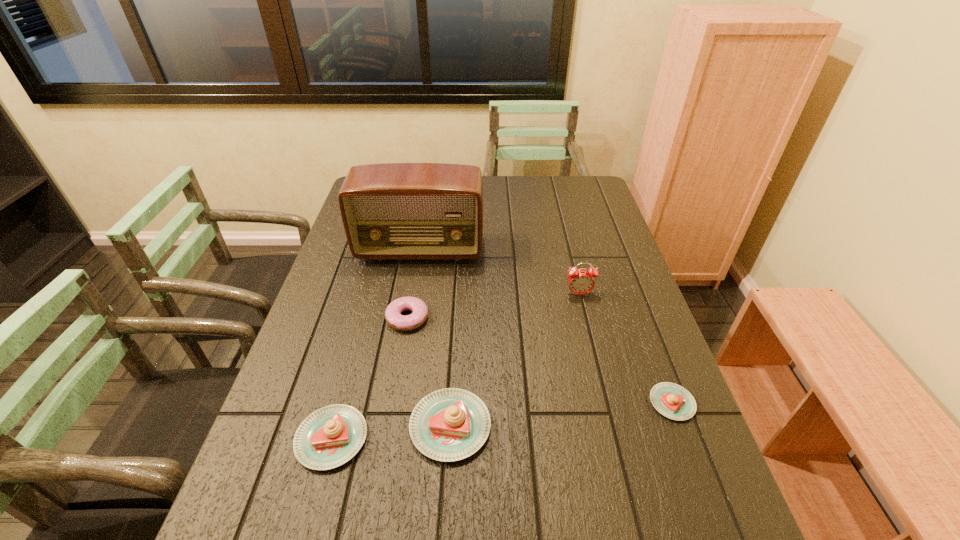
To achieve even spacing by inserting another pastry among them, please point to a vacant spot for this new pastry. Please provide its 2D coordinates. Your answer should be formatted as a tuple, i.e. [(x, y)], where the tuple contains the x and y coordinates of a point satisfying the conditions above.

[(564, 414)]